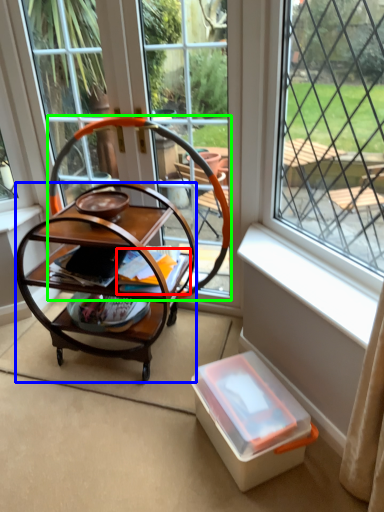
Question: Which object is positioned farthest from magazine (highlighted by a red box)? Select from desk (highlighted by a blue box) and rocking chair (highlighted by a green box).

Choices:
 (A) desk
 (B) rocking chair

Answer: (B)